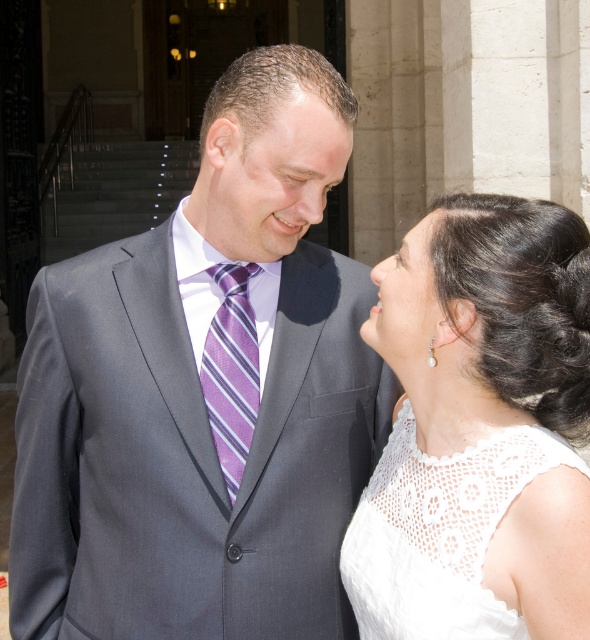
You are standing in front of the wedding scene and want to determine which of the two points, point (250,324) or point (316,100), is closer to you. Which one is closer?

Point (250,324) is closer to you because it is further to the viewer than point (316,100).

You are standing in front of the couple at the wedding. You notice two points in the image, one at coordinates point (363, 593) and the other at point (219, 378). Which point is nearer to you?

Point (363, 593) is closer to the viewer than point (219, 378).

You are a photographer trying to capture a closeup shot of the purple striped tie at center. The camera you are using has a focal length of 50mm and an aperture of f2.8. The camera is positioned at point A, which is 2 meters away from the tie. To ensure the tie is in focus, you need to know its exact position. Where is the purple striped tie located in the image?

The purple striped tie at center is located at point (231, 371) in the image.